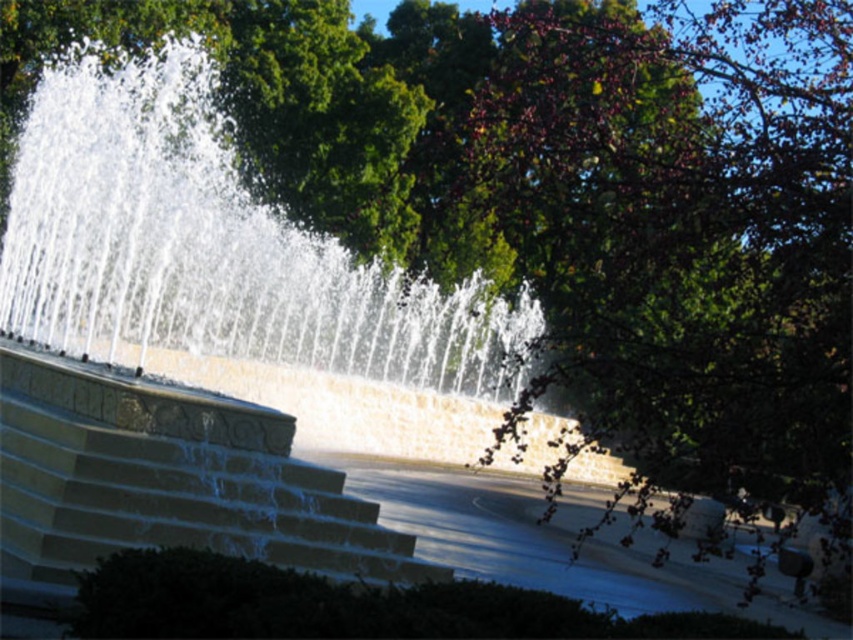
In the scene shown: You are standing in the outdoor area near the fountain and want to place a small statue between the two points labeled point (322, 365) and point (380, 566). Since you can only place it in front of one of the points, which point should you choose to ensure the statue is visible from the front of the fountain?

You should place the statue in front of point (380, 566) because point (322, 365) is behind point (380, 566). This way, the statue will be visible from the front of the fountain as it won not be blocked by point (322, 365).